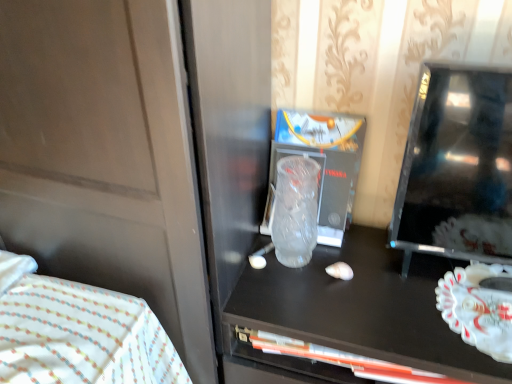
What is the approximate width of black glossy tv at right?

black glossy tv at right is 5.56 inches in width.

Identify the location of black glossy tv at right. (457, 168).

Describe the element at coordinates (478, 309) in the screenshot. I see `white glossy plate at right` at that location.

I want to click on white glossy plate at right, so click(x=478, y=309).

At what (x,y) coordinates should I click in order to perform the action: click on transparent frosted glass at center. Please return your answer as a coordinate pair (x, y). This screenshot has height=384, width=512. Looking at the image, I should click on (295, 210).

Find the location of `black glossy tv at right`. black glossy tv at right is located at coordinates (457, 168).

Is white glossy plate at right positioned behind transparent frosted glass at center?

No.

Which is less distant, [459,274] or [302,212]?

The point [302,212] is closer.

Is white glossy plate at right not close to transparent frosted glass at center?

No, there isn't a large distance between white glossy plate at right and transparent frosted glass at center.

Could you tell me if white glossy plate at right is facing transparent frosted glass at center?

No, white glossy plate at right is not aimed at transparent frosted glass at center.

Is black glossy tv at right in front of or behind white glossy plate at right in the image?

black glossy tv at right is in front of white glossy plate at right.

Between point (410, 221) and point (509, 355), which one is positioned behind?

Point (410, 221)

Based on the photo, from the image's perspective, is black glossy tv at right located beneath white glossy plate at right?

No.

In the scene shown: From a real-world perspective, is black glossy tv at right physically located above or below transparent frosted glass at center?

In terms of real-world spatial position, black glossy tv at right is above transparent frosted glass at center.

Is there a large distance between black glossy tv at right and transparent frosted glass at center?

No, black glossy tv at right is in close proximity to transparent frosted glass at center.

Is transparent frosted glass at center inside black glossy tv at right?

That's incorrect, transparent frosted glass at center is not inside black glossy tv at right.

Which is more to the left, black glossy tv at right or transparent frosted glass at center?

Positioned to the left is transparent frosted glass at center.

Considering the relative positions of transparent frosted glass at center and white glossy plate at right in the image provided, is transparent frosted glass at center to the right of white glossy plate at right from the viewer's perspective?

No.

From a real-world perspective, between transparent frosted glass at center and white glossy plate at right, who is vertically higher?

In real-world perspective, transparent frosted glass at center is above.

In the scene shown: Is transparent frosted glass at center in front of or behind white glossy plate at right in the image?

Clearly, transparent frosted glass at center is behind white glossy plate at right.

Measure the distance between transparent frosted glass at center and white glossy plate at right.

They are 14.59 inches apart.

From a real-world perspective, between white fabric bed at lower left and white glossy plate at right, who is vertically lower?

white fabric bed at lower left, from a real-world perspective.

Is white fabric bed at lower left inside the boundaries of white glossy plate at right, or outside?

The correct answer is: outside.

Is white fabric bed at lower left closer to camera compared to white glossy plate at right?

Yes, it is in front of white glossy plate at right.

The image size is (512, 384). What are the coordinates of `appliance located on the right of white fabric bed at lower left` in the screenshot? It's located at (457, 168).

Between white fabric bed at lower left and black glossy tv at right, which one has smaller width?

Thinner between the two is black glossy tv at right.

Is point (115, 330) behind point (405, 206)?

That is False.

Considering the relative positions of white fabric bed at lower left and black glossy tv at right in the image provided, is white fabric bed at lower left to the right of black glossy tv at right from the viewer's perspective?

No.

From a real-world perspective, does transparent frosted glass at center stand above black glossy tv at right?

No, from a real-world perspective, transparent frosted glass at center is not over black glossy tv at right

Between transparent frosted glass at center and black glossy tv at right, which one is positioned behind?

Positioned behind is transparent frosted glass at center.

Between transparent frosted glass at center and black glossy tv at right, which one has smaller size?

With smaller size is transparent frosted glass at center.

Looking at this image, can you confirm if transparent frosted glass at center is taller than black glossy tv at right?

In fact, transparent frosted glass at center may be shorter than black glossy tv at right.

Image resolution: width=512 pixels, height=384 pixels. Find the location of `glass vase above the white glossy plate at right (from a real-world perspective)`. glass vase above the white glossy plate at right (from a real-world perspective) is located at coordinates (295, 210).

Locate an element on the screen. appliance located above the white glossy plate at right (from the image's perspective) is located at coordinates (457, 168).

Estimate the real-world distances between objects in this image. Which object is further from white glossy plate at right, black glossy tv at right or white fabric bed at lower left?

white fabric bed at lower left lies further to white glossy plate at right than the other object.

Which object lies nearer to the anchor point black glossy tv at right, white glossy plate at right or white fabric bed at lower left?

Based on the image, white glossy plate at right appears to be nearer to black glossy tv at right.

Which object lies further to the anchor point white glossy plate at right, white fabric bed at lower left or black glossy tv at right?

Based on the image, white fabric bed at lower left appears to be further to white glossy plate at right.

Based on their spatial positions, is black glossy tv at right or white fabric bed at lower left closer to transparent frosted glass at center?

black glossy tv at right.

When comparing their distances from transparent frosted glass at center, does white glossy plate at right or black glossy tv at right seem further?

Based on the image, white glossy plate at right appears to be further to transparent frosted glass at center.

Looking at the image, which one is located closer to white fabric bed at lower left, white glossy plate at right or black glossy tv at right?

Based on the image, black glossy tv at right appears to be nearer to white fabric bed at lower left.

When comparing their distances from white glossy plate at right, does black glossy tv at right or transparent frosted glass at center seem further?

Among the two, transparent frosted glass at center is located further to white glossy plate at right.

Looking at the image, which one is located further to black glossy tv at right, white glossy plate at right or transparent frosted glass at center?

Based on the image, transparent frosted glass at center appears to be further to black glossy tv at right.

The width and height of the screenshot is (512, 384). I want to click on glass vase between white fabric bed at lower left and white glossy plate at right from left to right, so click(295, 210).

You are a GUI agent. You are given a task and a screenshot of the screen. Output one action in this format:
    pyautogui.click(x=<x>, y=<y>)
    Task: Click on the appliance between transparent frosted glass at center and white glossy plate at right in the horizontal direction
    
    Given the screenshot: What is the action you would take?
    [457, 168]

This screenshot has width=512, height=384. In order to click on appliance between white fabric bed at lower left and white glossy plate at right in this screenshot , I will do `click(457, 168)`.

You are a GUI agent. You are given a task and a screenshot of the screen. Output one action in this format:
    pyautogui.click(x=<x>, y=<y>)
    Task: Click on the glass vase between white fabric bed at lower left and black glossy tv at right from left to right
    The image size is (512, 384).
    Given the screenshot: What is the action you would take?
    pyautogui.click(x=295, y=210)